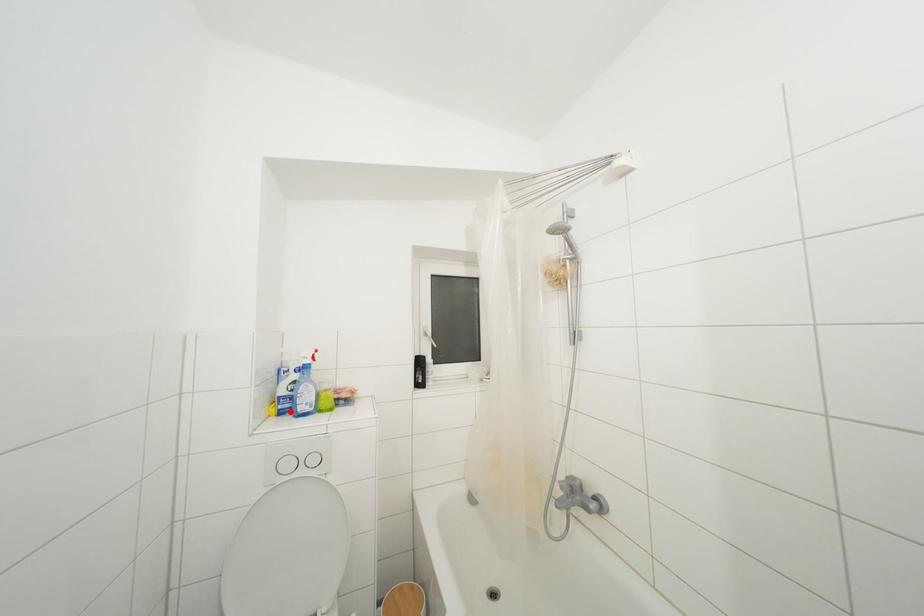
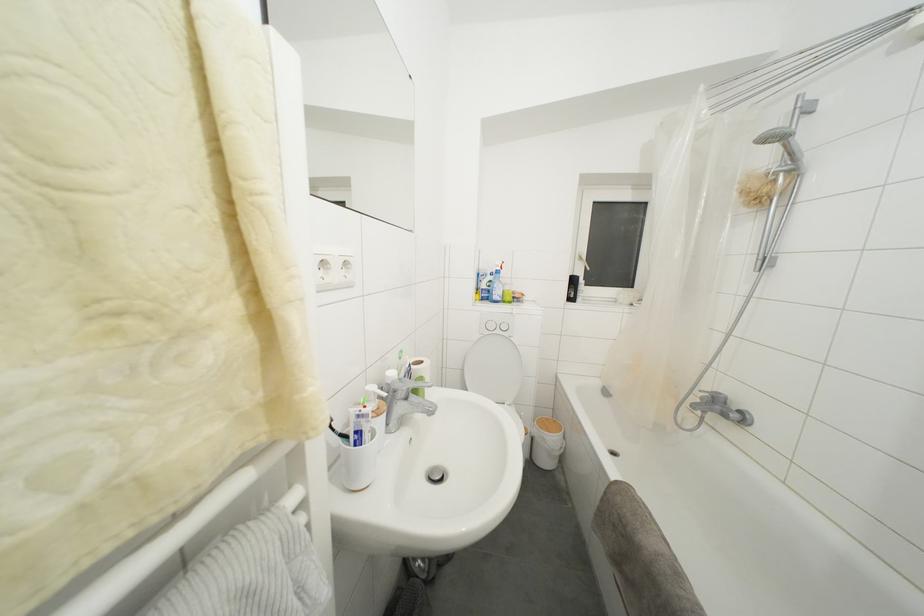
Locate, in the second image, the point that corresponds to the highlighted location in the first image.

(490, 301)